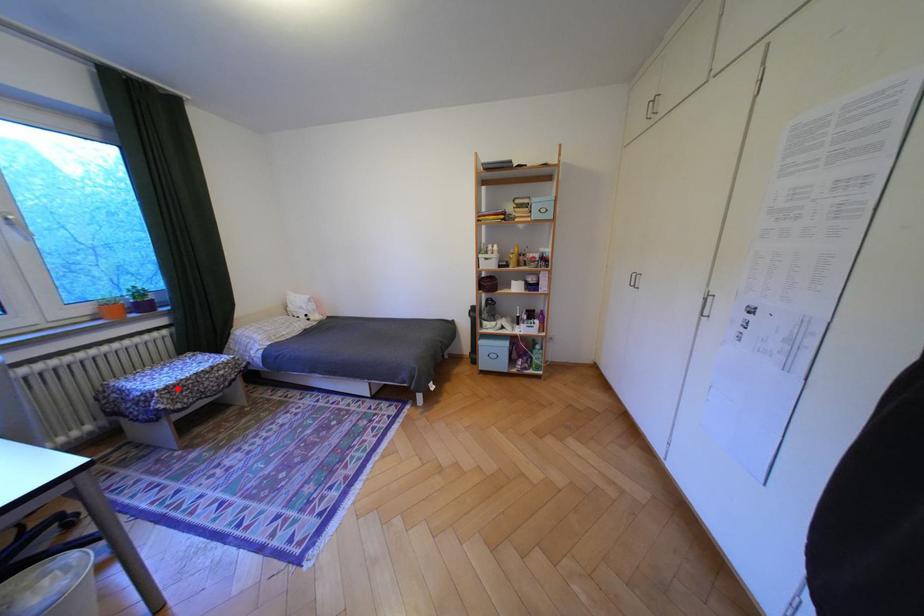
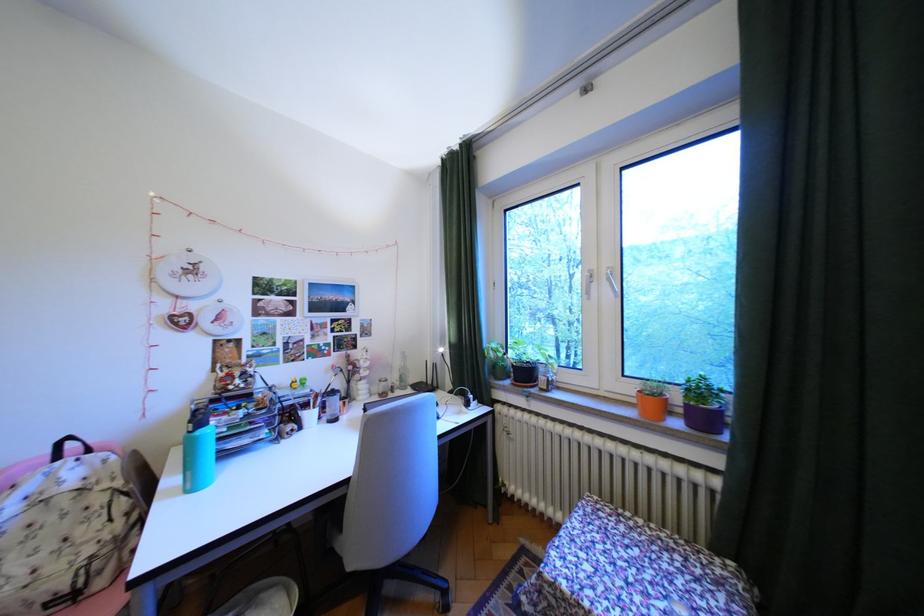
Find the pixel in the second image that matches the highlighted location in the first image.

(564, 585)